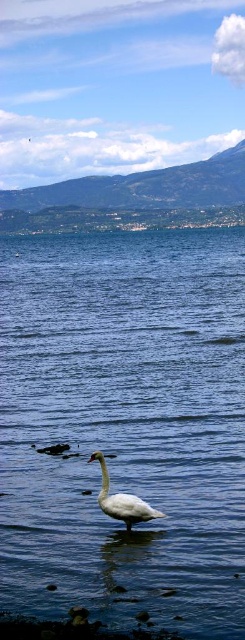
You are an artist planning to paint the lakeside scene. You want to ensure the blue water at center and the white matte swan at center are proportionally accurate. Which object should you paint first to maintain the correct size relationship between them?

You should paint the blue water at center first since it is bigger than the white matte swan at center, ensuring the swan is smaller in proportion to the water.

You are a photographer trying to capture the white matte swan at center in your shot. You notice the blue water at center is blocking your view. Can you adjust your position to see the swan clearly?

The blue water at center is in front of the white matte swan at center, so moving your position to get a better angle behind the water might allow you to see the swan clearly.